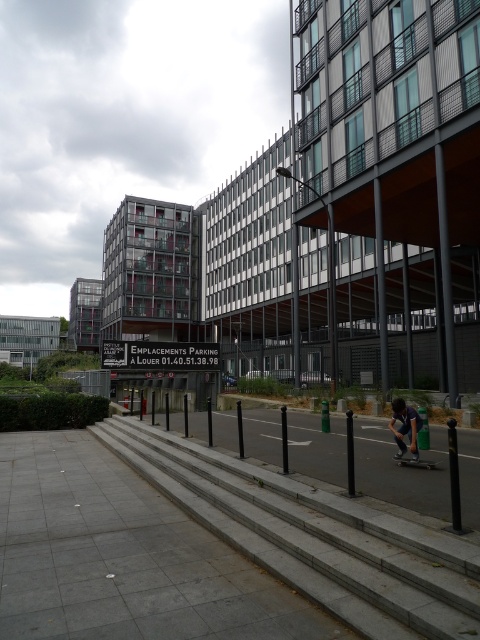
Question: Based on their relative distances, which object is farther from the black smooth skateboard at lower right?

Choices:
 (A) gray concrete stairs at center
 (B) dark blue jeans at lower right

Answer: (A)

Question: Which of the following is the farthest from the observer?

Choices:
 (A) dark blue jeans at lower right
 (B) gray concrete stairs at center
 (C) black smooth skateboard at lower right

Answer: (C)

Question: Can you confirm if dark blue jeans at lower right is thinner than black smooth skateboard at lower right?

Choices:
 (A) yes
 (B) no

Answer: (B)

Question: Among these points, which one is nearest to the camera?

Choices:
 (A) (414, 577)
 (B) (421, 464)
 (C) (402, 397)

Answer: (A)

Question: Where is gray concrete stairs at center located in relation to dark blue jeans at lower right in the image?

Choices:
 (A) above
 (B) below

Answer: (B)

Question: Can you confirm if gray concrete stairs at center is smaller than black smooth skateboard at lower right?

Choices:
 (A) yes
 (B) no

Answer: (B)